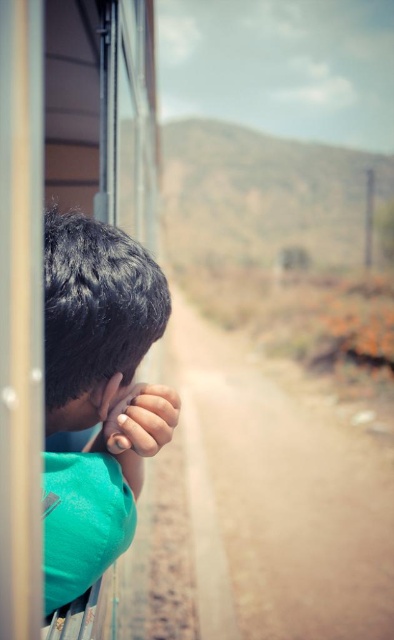
You are a passenger sitting in the train and looking at the dark brown hair at left and the nail polish painted fingernails at lower left. Which object is higher in position?

The dark brown hair at left is taller than the nail polish painted fingernails at lower left.

You are a designer creating a scale model of the train scene. The model will be 1 inch to 1 foot. If the actual distance between the dark brown hair at left and the nail polish painted fingernails at lower left is 3.45 inches, what should the distance be in your model?

The distance between the dark brown hair at left and the nail polish painted fingernails at lower left in the model should be 3.45 inches divided by 12, resulting in approximately 0.2875 inches. However, since the scale is 1 inch to 1 foot, the model distance should be 3.45 inches divided by 12, which equals 0.2875 inches, or roughly 0.29 inches.

You are a passenger sitting in the train and looking at the dark brown hair at left and the nail polish painted fingernails at lower left. Which object appears bigger in the scene?

The dark brown hair at left has a larger size compared to the nail polish painted fingernails at lower left, so the dark brown hair at left appears bigger in the scene.